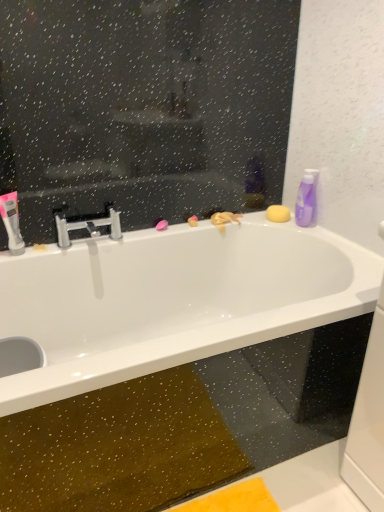
Locate an element on the screen. The image size is (384, 512). vacant area that is in front of purple glossy bottle at upper right is located at coordinates (320, 234).